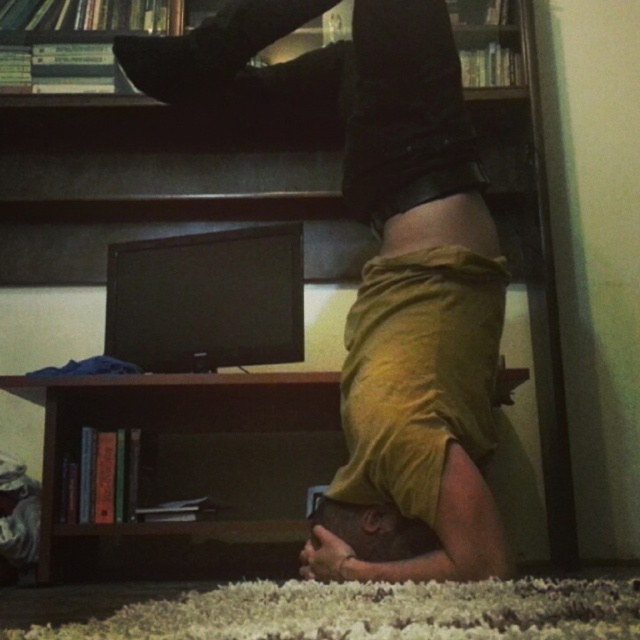
Can you confirm if mustard yellow fabric at center is wider than black matte shoe at upper center?

Indeed, mustard yellow fabric at center has a greater width compared to black matte shoe at upper center.

Who is positioned more to the right, mustard yellow fabric at center or black matte shoe at upper center?

Positioned to the right is mustard yellow fabric at center.

Identify the location of mustard yellow fabric at center. This screenshot has width=640, height=640. (406, 304).

The width and height of the screenshot is (640, 640). What do you see at coordinates (172, 433) in the screenshot? I see `brown wood bookshelf at lower center` at bounding box center [172, 433].

Can you confirm if brown wood bookshelf at lower center is thinner than matte black monitor at center?

No.

Identify the location of brown wood bookshelf at lower center. (172, 433).

Who is higher up, matte black monitor at center or black matte shoe at upper center?

black matte shoe at upper center is higher up.

Between matte black monitor at center and black matte shoe at upper center, which one appears on the right side from the viewer's perspective?

black matte shoe at upper center is more to the right.

Is point (289, 356) positioned in front of point (204, 49)?

That is False.

At what (x,y) coordinates should I click in order to perform the action: click on matte black monitor at center. Please return your answer as a coordinate pair (x, y). This screenshot has width=640, height=640. Looking at the image, I should click on (205, 300).